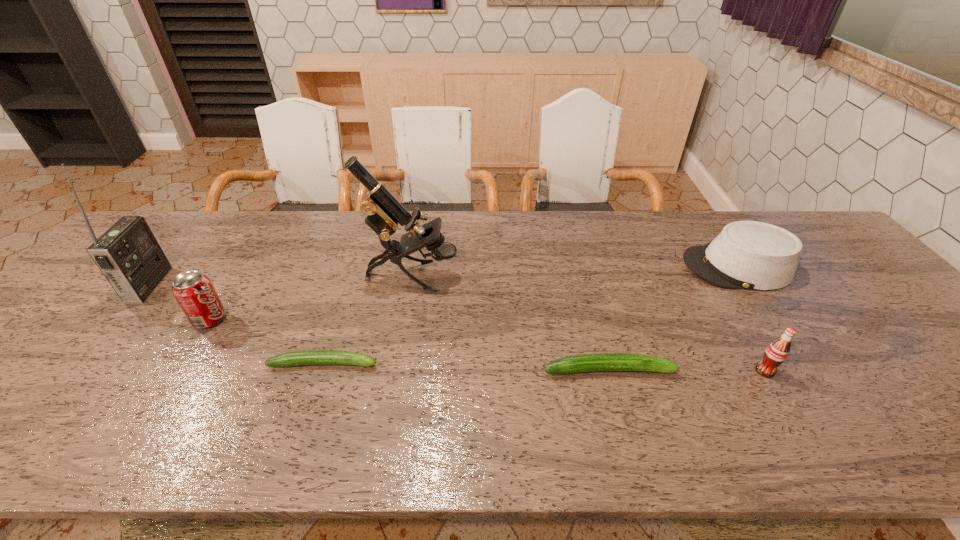
In order to click on vacant space located 0.220m on the front-facing side of the shorter zucchini in this screenshot , I will do `click(473, 363)`.

The image size is (960, 540). I want to click on vacant space positioned on the front-facing side of the fifth object from left to right, so click(784, 369).

This screenshot has height=540, width=960. What are the coordinates of `free location located 0.130m on the front-facing side of the third shortest object` in the screenshot? It's located at (637, 267).

You are a GUI agent. You are given a task and a screenshot of the screen. Output one action in this format:
    pyautogui.click(x=<x>, y=<y>)
    Task: Click on the free space located on the front-facing side of the third shortest object
    
    Given the screenshot: What is the action you would take?
    pyautogui.click(x=596, y=267)

At what (x,y) coordinates should I click in order to perform the action: click on vacant space located on the front-facing side of the third shortest object. Please return your answer as a coordinate pair (x, y). Looking at the image, I should click on (655, 267).

Locate an element on the screen. vacant space situated 0.310m on the display of the radio receiver is located at coordinates pyautogui.click(x=272, y=284).

Where is `free space located through the eyepiece of the microscope`? Image resolution: width=960 pixels, height=540 pixels. free space located through the eyepiece of the microscope is located at coordinates (496, 276).

The width and height of the screenshot is (960, 540). What are the coordinates of `free location located on the right of the farther soda` in the screenshot? It's located at (320, 319).

Image resolution: width=960 pixels, height=540 pixels. In order to click on free space located 0.210m on the back of the nearer soda in this screenshot , I will do `click(723, 300)`.

I want to click on object that is at the far edge, so [x=753, y=255].